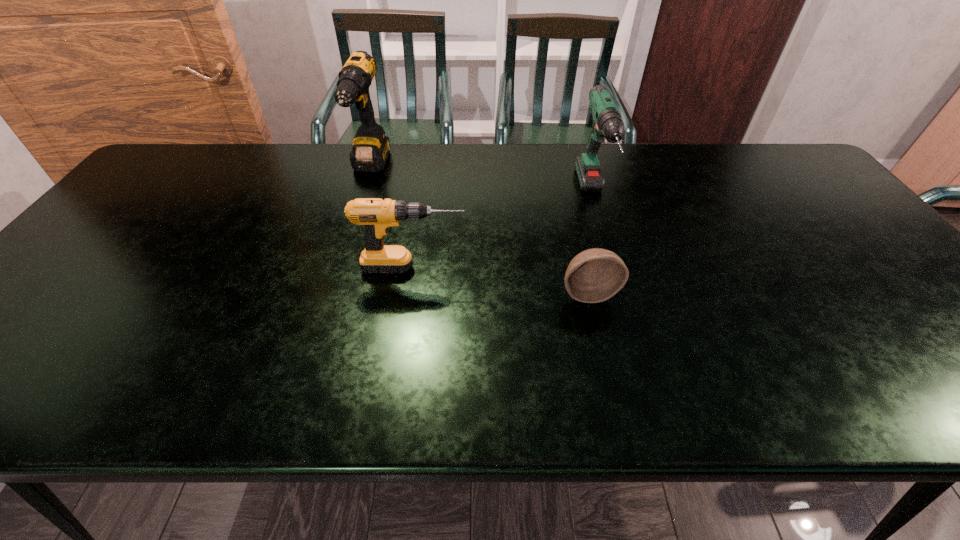
The image size is (960, 540). What are the coordinates of `the leftmost object` in the screenshot? It's located at (370, 150).

Where is `the rightmost drill`? This screenshot has height=540, width=960. the rightmost drill is located at coordinates (607, 124).

You are a GUI agent. You are given a task and a screenshot of the screen. Output one action in this format:
    pyautogui.click(x=<x>, y=<y>)
    Task: Click on the shortest drill
    
    Given the screenshot: What is the action you would take?
    pyautogui.click(x=378, y=215)

This screenshot has height=540, width=960. What are the coordinates of `the second nearest object` in the screenshot? It's located at [378, 215].

Locate an element on the screen. bowl is located at coordinates (595, 275).

This screenshot has height=540, width=960. What are the coordinates of `the shortest object` in the screenshot? It's located at (595, 275).

You are a GUI agent. You are given a task and a screenshot of the screen. Output one action in this format:
    pyautogui.click(x=<x>, y=<y>)
    Task: Click on the vacant space located 0.280m at the tip of the leftmost drill
    The width and height of the screenshot is (960, 540).
    Given the screenshot: What is the action you would take?
    tap(342, 258)

Locate an element on the screen. The width and height of the screenshot is (960, 540). free location located on the handle side of the rightmost drill is located at coordinates (614, 269).

Find the location of a particular element. vacant region located 0.300m at the tip of the second object from left to right is located at coordinates (588, 268).

I want to click on vacant point located 0.200m on the back of the bowl, so click(574, 227).